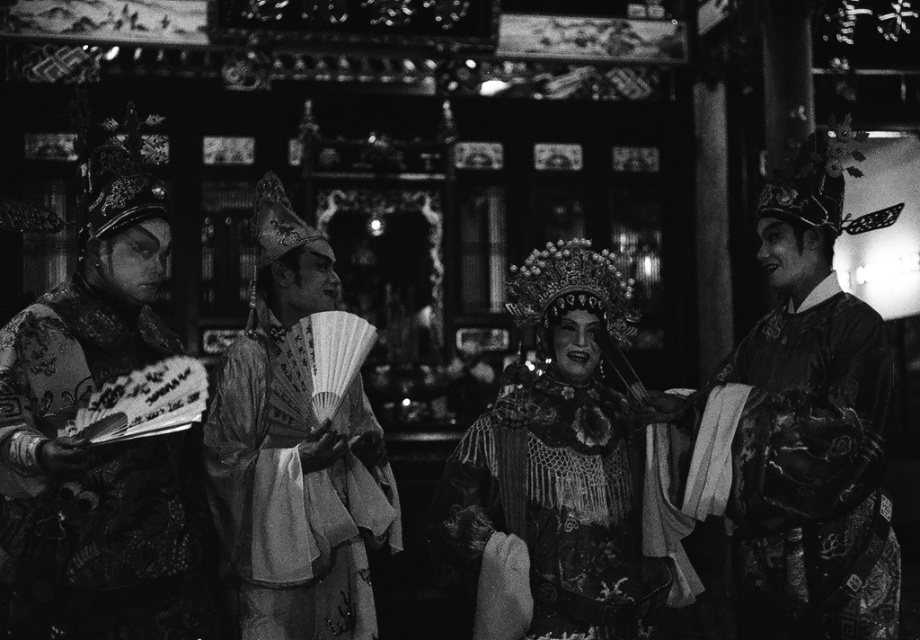
Question: Which of these objects is positioned closest to the matte black fan at left?

Choices:
 (A) silky black robe at right
 (B) matte ornate headdress at center
 (C) silky white robe at center

Answer: (C)

Question: Can you confirm if matte black fan at left is smaller than silky white robe at center?

Choices:
 (A) no
 (B) yes

Answer: (B)

Question: Which object appears closest to the camera in this image?

Choices:
 (A) silky black robe at right
 (B) matte ornate headdress at center
 (C) matte black fan at left

Answer: (C)

Question: Which object is closer to the camera taking this photo?

Choices:
 (A) matte black fan at left
 (B) matte ornate headdress at center
 (C) silky black robe at right
 (D) silky white robe at center

Answer: (A)

Question: Is silky black robe at right positioned behind silky white robe at center?

Choices:
 (A) no
 (B) yes

Answer: (B)

Question: Considering the relative positions of matte black fan at left and matte ornate headdress at center in the image provided, where is matte black fan at left located with respect to matte ornate headdress at center?

Choices:
 (A) below
 (B) above

Answer: (B)